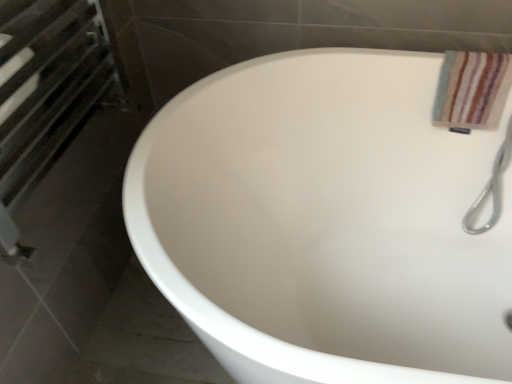
Question: Should I look upward or downward to see matte metal towel rack at left?

Choices:
 (A) down
 (B) up

Answer: (B)

Question: Is the position of matte metal towel rack at left less distant than that of white glossy bathtub at center?

Choices:
 (A) yes
 (B) no

Answer: (B)

Question: From a real-world perspective, is matte metal towel rack at left on top of white glossy bathtub at center?

Choices:
 (A) no
 (B) yes

Answer: (B)

Question: Does matte metal towel rack at left have a lesser height compared to white glossy bathtub at center?

Choices:
 (A) yes
 (B) no

Answer: (A)

Question: Does matte metal towel rack at left turn towards white glossy bathtub at center?

Choices:
 (A) yes
 (B) no

Answer: (A)

Question: From a real-world perspective, is matte metal towel rack at left under white glossy bathtub at center?

Choices:
 (A) no
 (B) yes

Answer: (A)

Question: Is there a large distance between matte metal towel rack at left and white glossy bathtub at center?

Choices:
 (A) yes
 (B) no

Answer: (B)

Question: Considering the relative sizes of white glossy bathtub at center and striped cotton towel at upper right in the image provided, is white glossy bathtub at center thinner than striped cotton towel at upper right?

Choices:
 (A) yes
 (B) no

Answer: (B)

Question: From the image's perspective, is white glossy bathtub at center beneath striped cotton towel at upper right?

Choices:
 (A) yes
 (B) no

Answer: (A)

Question: Is white glossy bathtub at center oriented towards striped cotton towel at upper right?

Choices:
 (A) yes
 (B) no

Answer: (B)

Question: From a real-world perspective, does white glossy bathtub at center stand above striped cotton towel at upper right?

Choices:
 (A) no
 (B) yes

Answer: (A)

Question: From the image's perspective, is white glossy bathtub at center on striped cotton towel at upper right?

Choices:
 (A) no
 (B) yes

Answer: (A)

Question: From a real-world perspective, is white glossy bathtub at center beneath striped cotton towel at upper right?

Choices:
 (A) yes
 (B) no

Answer: (A)

Question: Can you confirm if white glossy bathtub at center is taller than matte metal towel rack at left?

Choices:
 (A) yes
 (B) no

Answer: (A)